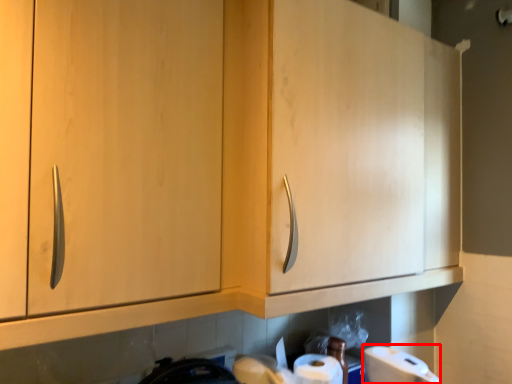
Question: Where is toilet paper (annotated by the red box) located in relation to cabinetry in the image?

Choices:
 (A) left
 (B) right

Answer: (B)